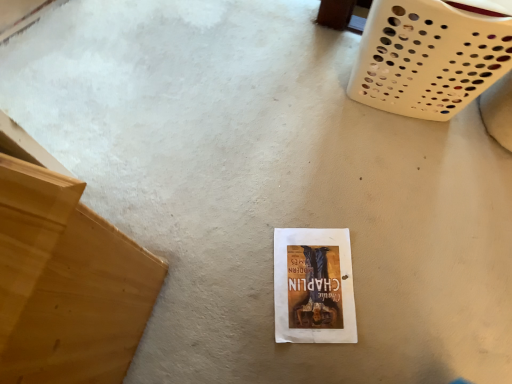
This screenshot has height=384, width=512. Find the location of `vacant area situated to the left side of white paper at center`. vacant area situated to the left side of white paper at center is located at coordinates (226, 274).